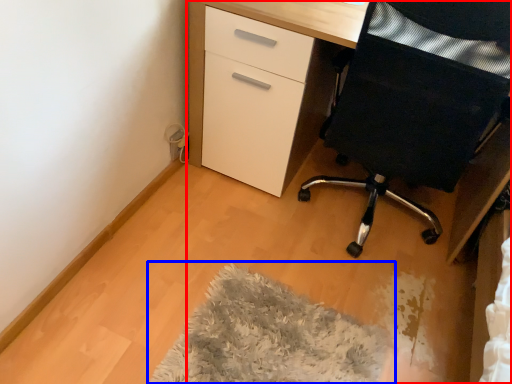
Question: Which point is further to the camera, desk (highlighted by a red box) or mat (highlighted by a blue box)?

Choices:
 (A) desk
 (B) mat

Answer: (A)